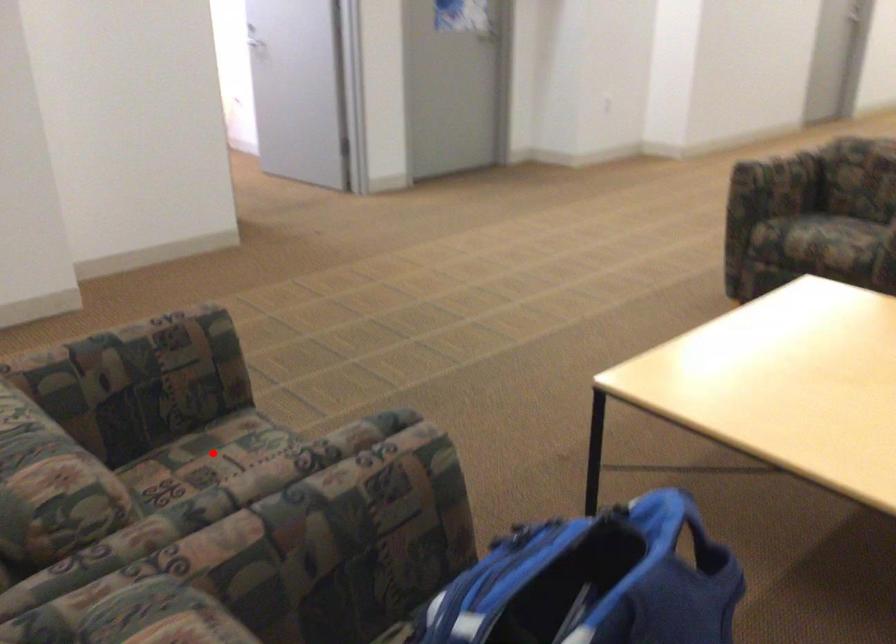
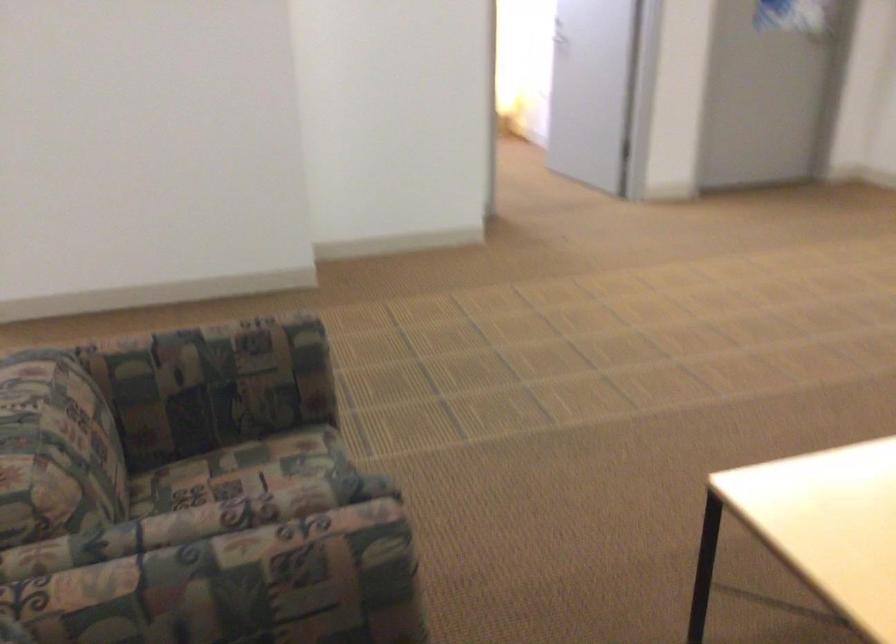
Find the pixel in the second image that matches the highlighted location in the first image.

(254, 468)